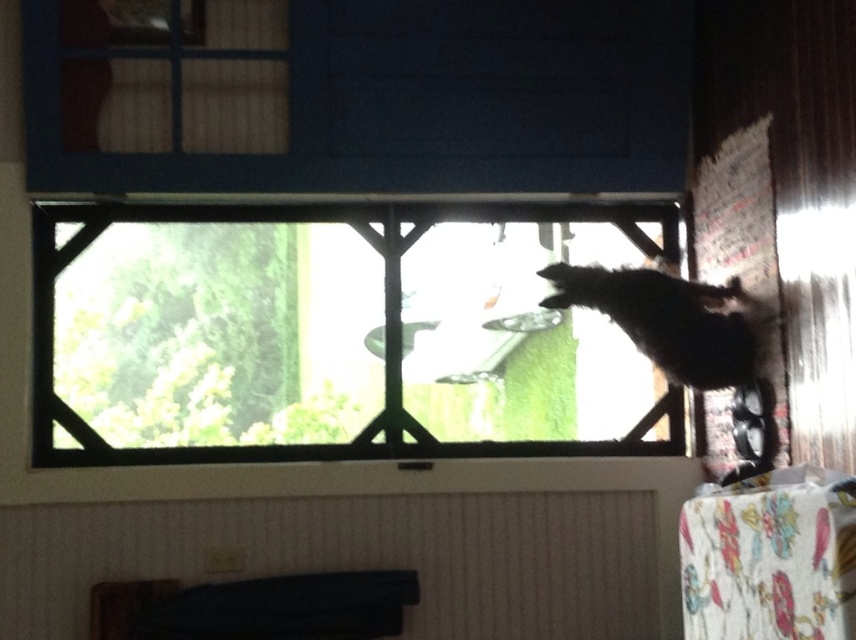
Who is positioned more to the right, white paper at right or black fur cat at right?

Positioned to the right is white paper at right.

Is white paper at right taller than black fur cat at right?

Correct, white paper at right is much taller as black fur cat at right.

Image resolution: width=856 pixels, height=640 pixels. Describe the element at coordinates (795, 189) in the screenshot. I see `white paper at right` at that location.

The height and width of the screenshot is (640, 856). Identify the location of white paper at right. (795, 189).

What do you see at coordinates (357, 556) in the screenshot? This screenshot has height=640, width=856. I see `black fabric at lower center` at bounding box center [357, 556].

Which is in front, point (94, 509) or point (782, 100)?

Positioned in front is point (782, 100).

What do you see at coordinates (357, 556) in the screenshot? I see `black fabric at lower center` at bounding box center [357, 556].

Locate an element on the screen. The width and height of the screenshot is (856, 640). black fabric at lower center is located at coordinates (357, 556).

Between point (72, 515) and point (581, 300), which one is positioned behind?

The point (72, 515) is behind.

Consider the image. Is black fabric at lower center positioned before black fur cat at right?

No, black fabric at lower center is behind black fur cat at right.

Find the location of `black fabric at lower center`. black fabric at lower center is located at coordinates (357, 556).